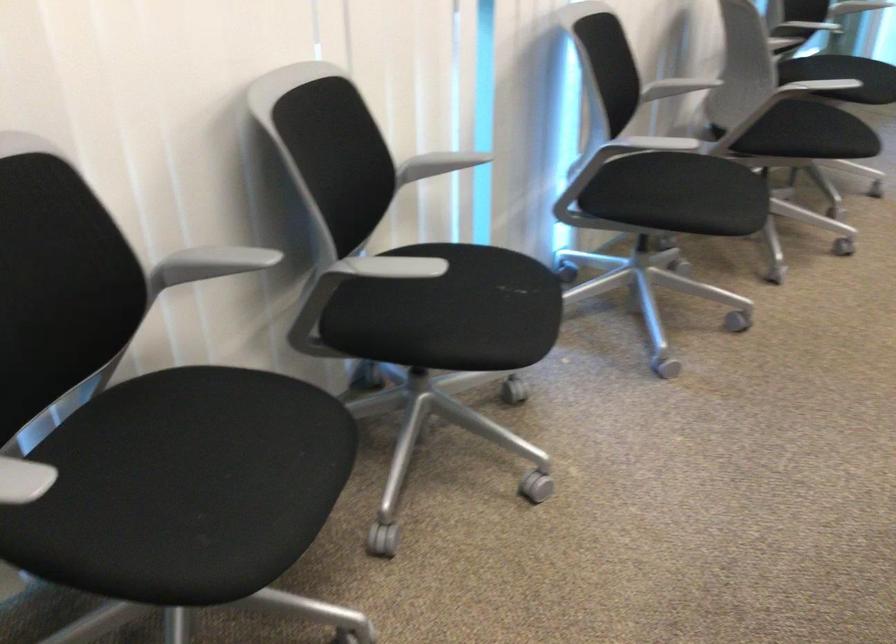
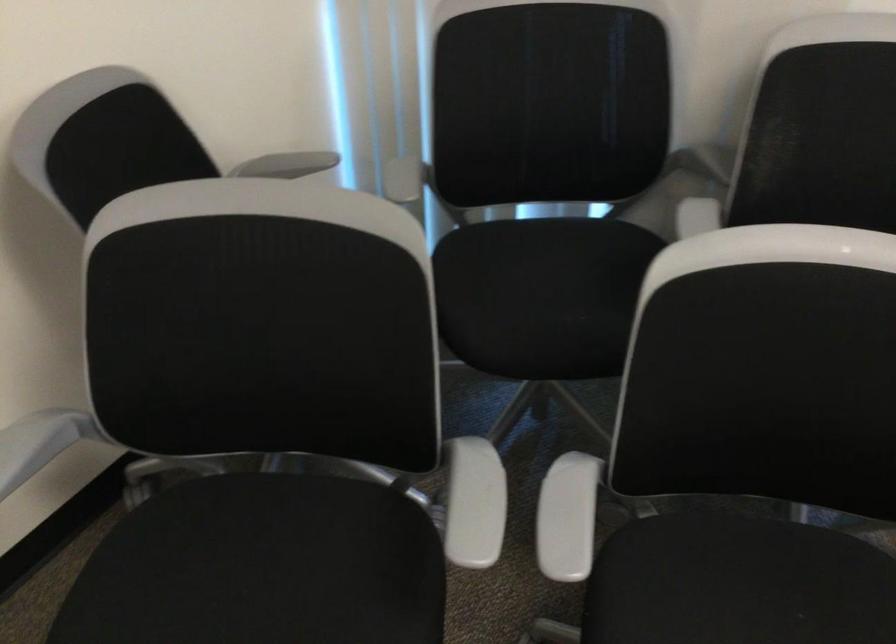
Based on the photo, how did the camera likely rotate?

The camera rotated toward left-down.